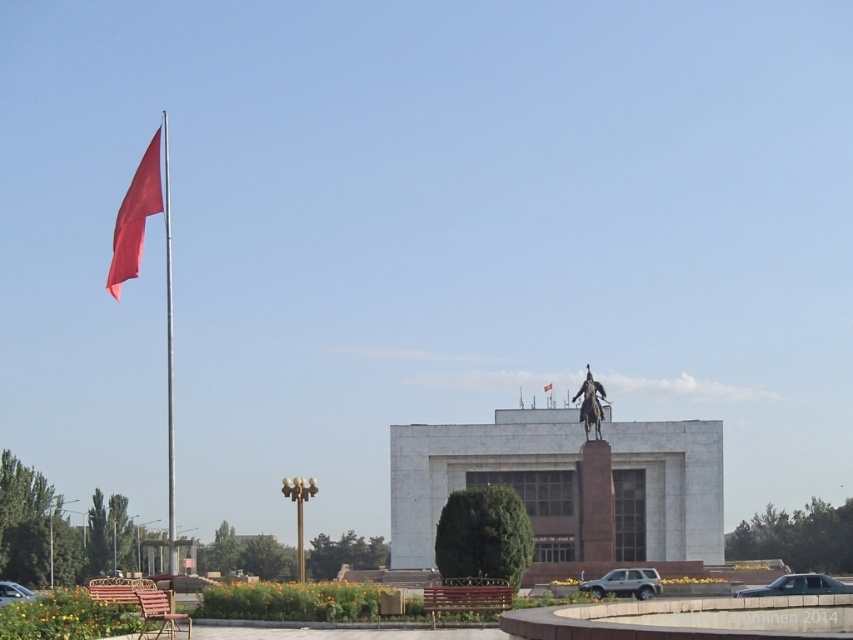
Can you confirm if metallic flag pole at left is positioned below metallic gray sedan at lower right?

Actually, metallic flag pole at left is above metallic gray sedan at lower right.

Is point (167, 372) more distant than point (796, 586)?

Yes, point (167, 372) is behind point (796, 586).

What do you see at coordinates (169, 358) in the screenshot? I see `metallic flag pole at left` at bounding box center [169, 358].

You are a GUI agent. You are given a task and a screenshot of the screen. Output one action in this format:
    pyautogui.click(x=<x>, y=<y>)
    Task: Click on the metallic flag pole at left
    This screenshot has height=640, width=853.
    Given the screenshot: What is the action you would take?
    pyautogui.click(x=169, y=358)

Does bronze statue at upper center have a greater width compared to metallic silver car at lower left?

In fact, bronze statue at upper center might be narrower than metallic silver car at lower left.

Who is more forward, (590, 374) or (3, 588)?

Point (3, 588) is in front.

Is point (599, 435) positioned after point (0, 593)?

Yes, point (599, 435) is behind point (0, 593).

Where is `bronze statue at upper center`? This screenshot has width=853, height=640. bronze statue at upper center is located at coordinates (590, 403).

Locate an element on the screen. The width and height of the screenshot is (853, 640). metallic gray sedan at lower right is located at coordinates (798, 586).

Is metallic gray sedan at lower right in front of red fabric flag at upper left?

Yes, it is.

This screenshot has height=640, width=853. In order to click on metallic gray sedan at lower right in this screenshot , I will do `click(798, 586)`.